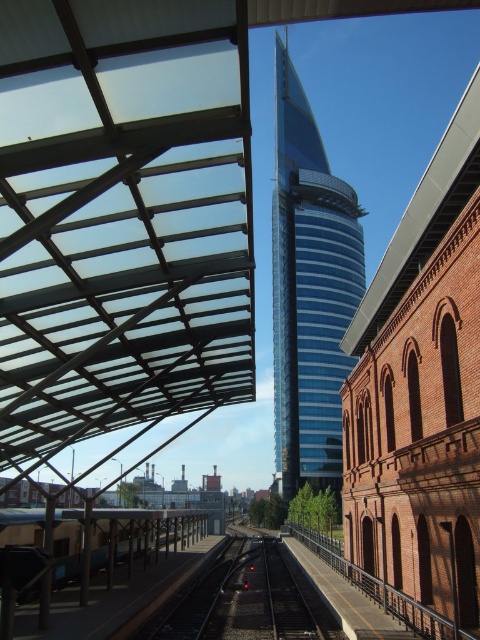
You are standing at the entrance of the train station on the left side of the image. You want to take a photo of the blue glass tower at center. Which direction should you face to capture it in your camera?

Since the blue glass tower at center is located at coordinates approximately 0.455 on the x axis and 0.646 on the y axis, you should face towards the right side of the image from your position at the train station on the left to capture it in your photo.

You are a delivery drone that needs to fly from the metallic gray train at lower left to the blue glass tower at center. What is the approximate distance you need to cover?

The blue glass tower at center is 298.09 feet away from the metallic gray train at lower left, so the drone needs to cover approximately 298.09 feet.

You are a photographer standing at the edge of the black asphalt train track at center, aiming to capture the blue glass tower at center in your shot. Based on their positions, will the tower be fully visible in the photo without any obstruction from the train track?

The blue glass tower at center is positioned over the black asphalt train track at center, so the tower will be fully visible in the photo without any obstruction from the train track.